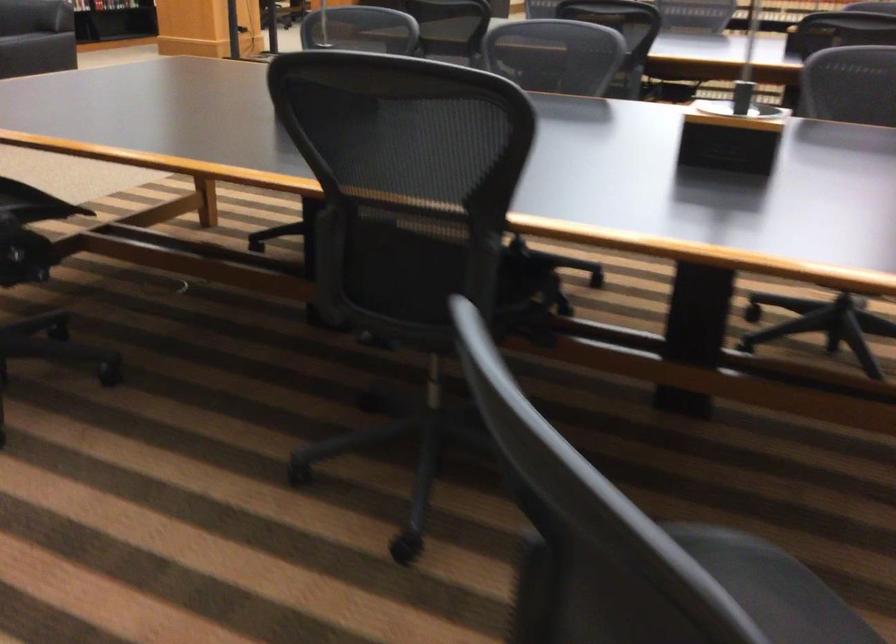
Find where to resting arm the sofa armrest. Please return your answer as a coordinate pair (x, y).

(35, 15)